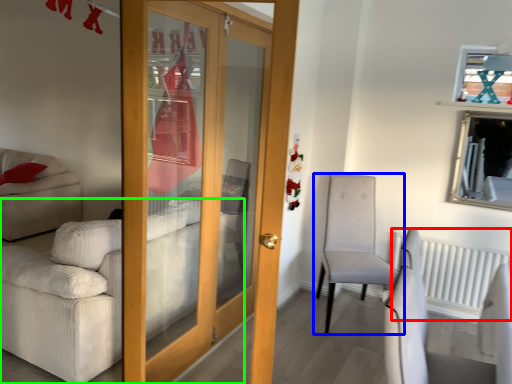
Question: Considering the real-world distances, which object is farthest from radiator (highlighted by a red box)? chair (highlighted by a blue box) or studio couch (highlighted by a green box)?

Choices:
 (A) chair
 (B) studio couch

Answer: (B)